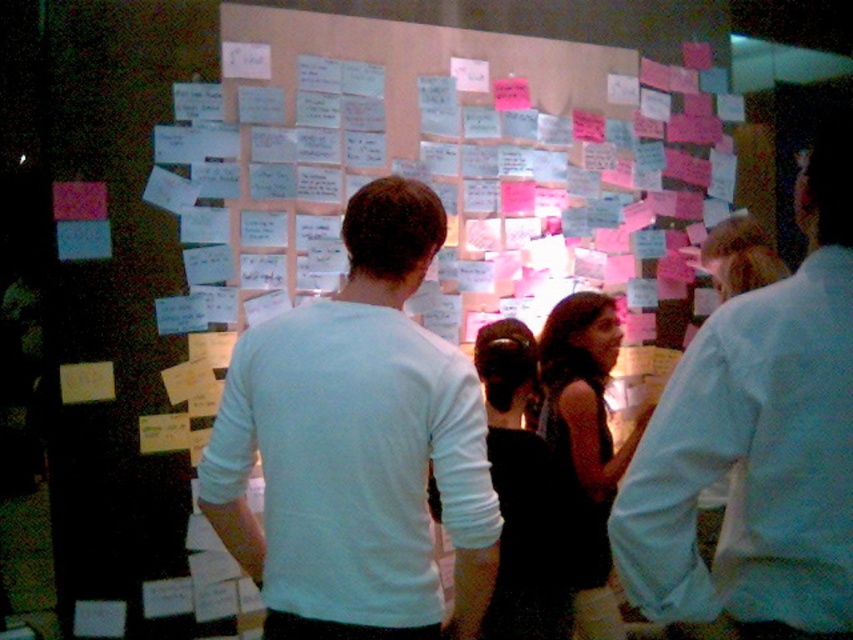
You are a photographer trying to capture a candid shot of the white matte shirt at upper right and the dark brown textured dress at center in the scene. The camera you have can only focus on objects within a 36 inch range. Will both subjects be in focus?

The white matte shirt at upper right and dark brown textured dress at center are 38.58 inches apart from each other, which exceeds the camera focus range of 36 inches. Therefore, both subjects cannot be in focus simultaneously.

You are standing in a room with a large board covered in sticky notes. You see a white matte shirt at center and a dark brown textured dress at center. Which clothing item is higher up on the person?

The white matte shirt at center is above the dark brown textured dress at center, so the white matte shirt at center is higher up on the person.